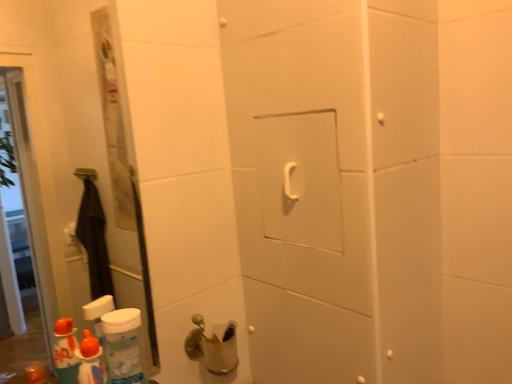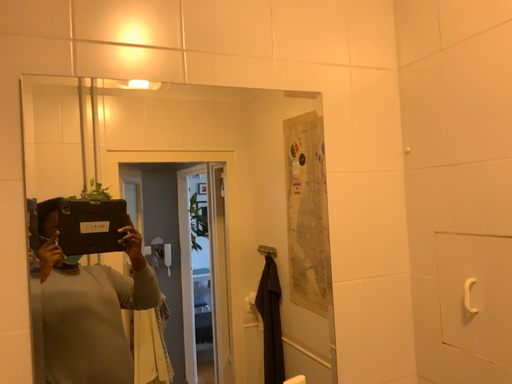
Question: How did the camera likely rotate when shooting the video?

Choices:
 (A) rotated left
 (B) rotated right

Answer: (A)